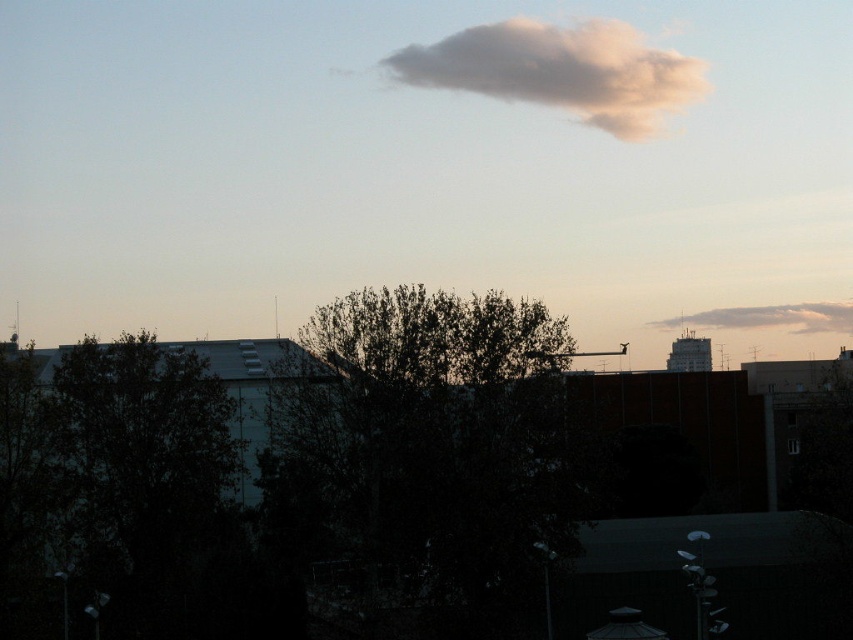
You are an architect designing a new building. You want to ensure that the building won not block the view of the white fluffy cloud at upper center from the dark green leafy tree at center. Which object should be shorter in your design?

The dark green leafy tree at center is not as tall as the white fluffy cloud at upper center. To ensure the view of the white fluffy cloud at upper center remains unobstructed from the dark green leafy tree at center, the new building should be shorter than the white fluffy cloud at upper center.

Based on the scene described, which object is larger when viewed from the perspective of an observer standing in the foreground? Please consider the dark green leafy tree at center and the white fluffy cloud at upper right in your answer.

The dark green leafy tree at center has a smaller size compared to the white fluffy cloud at upper right, so the white fluffy cloud at upper right is larger when viewed from the observer.

You are an urban planner analyzing the image. You need to determine which object between the dark green leafy tree at center and the white fluffy cloud at upper center takes up more area in the image. Based on the scene description, can you determine which one is larger in size?

The dark green leafy tree at center occupies less space than white fluffy cloud at upper center, so the white fluffy cloud at upper center is larger in size.